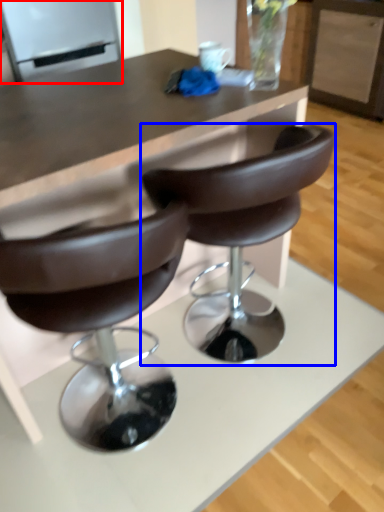
Question: Which point is further to the camera, appliance (highlighted by a red box) or chair (highlighted by a blue box)?

Choices:
 (A) appliance
 (B) chair

Answer: (A)